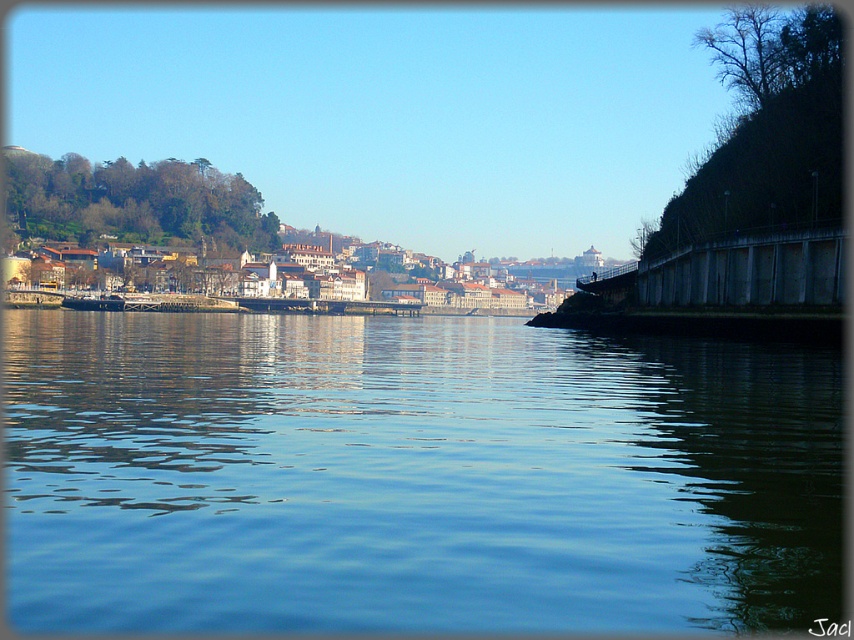
You are a photographer standing at the riverside and want to capture the reflection of the shiny black boat at center in the blue liquid water at center. Based on the scene description, will the boat be clearly visible in the water?

The blue liquid water at center is in front of the shiny black boat at center, so the boat is positioned behind the water. Since reflections typically show objects that are behind or above the reflective surface, the boat should be clearly visible in the water.